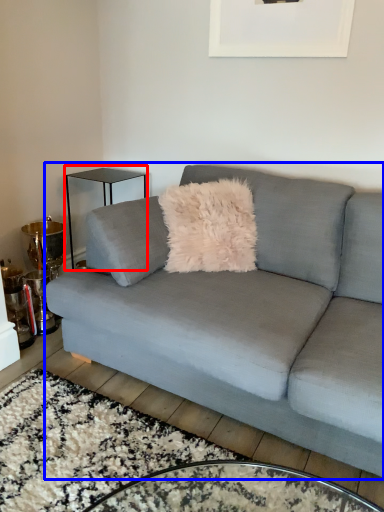
Question: Which point is closer to the camera, table (highlighted by a red box) or studio couch (highlighted by a blue box)?

Choices:
 (A) table
 (B) studio couch

Answer: (B)